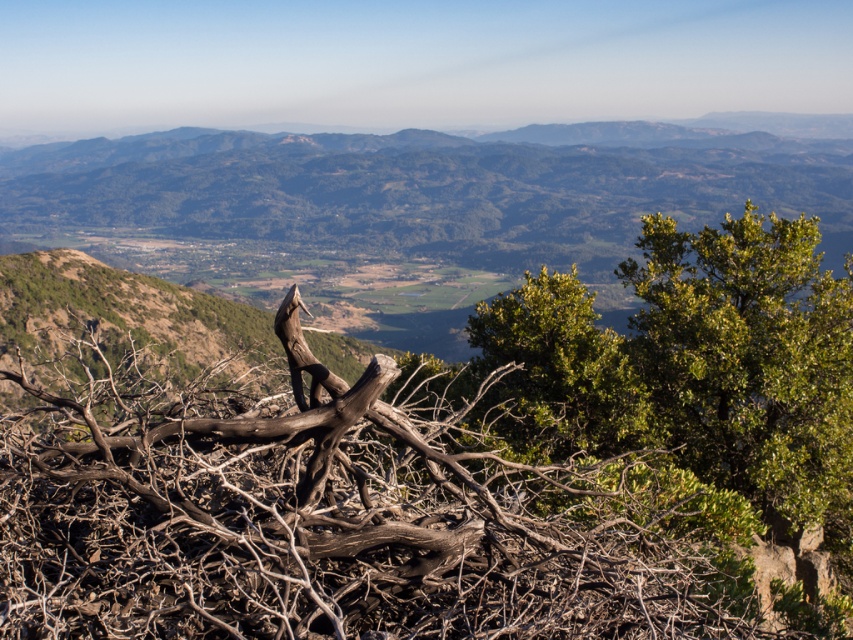
Question: Is brown/dry wood at center wider than green leafy shrub at right?

Choices:
 (A) no
 (B) yes

Answer: (B)

Question: From the image, what is the correct spatial relationship of brown/dry wood at center in relation to green leafy shrub at right?

Choices:
 (A) above
 (B) below

Answer: (B)

Question: Is brown/dry wood at center bigger than green leafy shrub at right?

Choices:
 (A) yes
 (B) no

Answer: (A)

Question: Which of the following is the closest to the observer?

Choices:
 (A) (547, 464)
 (B) (733, 316)

Answer: (A)

Question: Which of the following is the closest to the observer?

Choices:
 (A) green leafy shrub at right
 (B) brown/dry wood at center

Answer: (B)